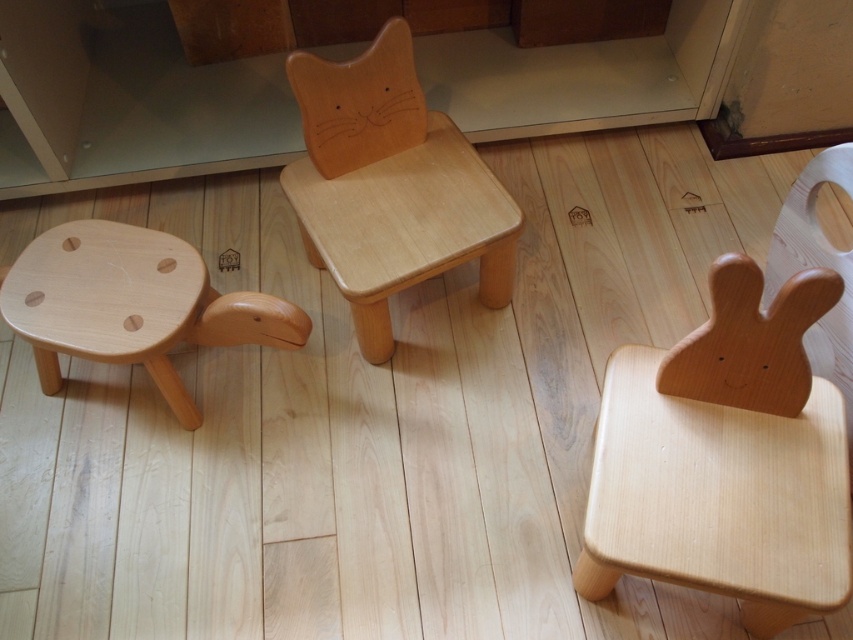
Does natural wood rabbit chair at right appear over natural wood stool at left?

No, natural wood rabbit chair at right is not above natural wood stool at left.

Who is positioned more to the right, natural wood rabbit chair at right or natural wood stool at left?

Positioned to the right is natural wood rabbit chair at right.

Image resolution: width=853 pixels, height=640 pixels. What do you see at coordinates (733, 440) in the screenshot? I see `natural wood rabbit chair at right` at bounding box center [733, 440].

Locate an element on the screen. Image resolution: width=853 pixels, height=640 pixels. natural wood rabbit chair at right is located at coordinates (733, 440).

Is natural wood cat-shaped chair at center to the right of natural wood stool at left from the viewer's perspective?

Yes, natural wood cat-shaped chair at center is to the right of natural wood stool at left.

Is natural wood cat-shaped chair at center smaller than natural wood stool at left?

No, natural wood cat-shaped chair at center is not smaller than natural wood stool at left.

Identify the location of natural wood cat-shaped chair at center. This screenshot has width=853, height=640. (390, 186).

Which is above, natural wood rabbit chair at right or natural wood cat-shaped chair at center?

Answer: Positioned higher is natural wood cat-shaped chair at center.

Does point (784, 566) lie in front of point (376, 189)?

Yes, it is.

Which is behind, point (668, 355) or point (341, 228)?

The point (341, 228) is more distant.

Locate an element on the screen. The width and height of the screenshot is (853, 640). natural wood rabbit chair at right is located at coordinates (733, 440).